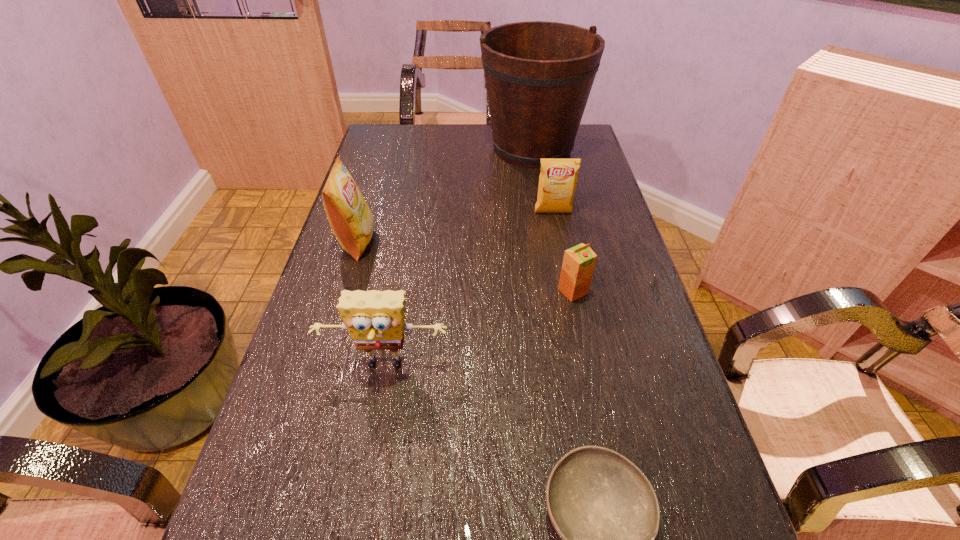
This screenshot has height=540, width=960. I want to click on free location located on the front-facing side of the taller crisp (potato chip), so click(x=451, y=242).

Find the location of `vacant space located on the face of the sponge`. vacant space located on the face of the sponge is located at coordinates (364, 485).

Find the location of a particular element. The image size is (960, 540). free region located on the front of the farther crisp (potato chip) with the logo is located at coordinates (565, 275).

Identify the location of vacant space situated on the left of the fifth tallest object. Image resolution: width=960 pixels, height=540 pixels. (464, 292).

Find the location of `object that is positioned at the far edge`. object that is positioned at the far edge is located at coordinates (538, 75).

This screenshot has width=960, height=540. In order to click on crisp (potato chip) at the left edge in this screenshot , I will do `click(352, 222)`.

Locate an element on the screen. sponge that is at the left edge is located at coordinates (375, 319).

I want to click on bucket situated at the right edge, so click(x=538, y=75).

At what (x,y) coordinates should I click in order to perform the action: click on crisp (potato chip) that is at the right edge. Please return your answer as a coordinate pair (x, y). Image resolution: width=960 pixels, height=540 pixels. Looking at the image, I should click on (557, 182).

In order to click on orange juice present at the right edge in this screenshot , I will do `click(579, 261)`.